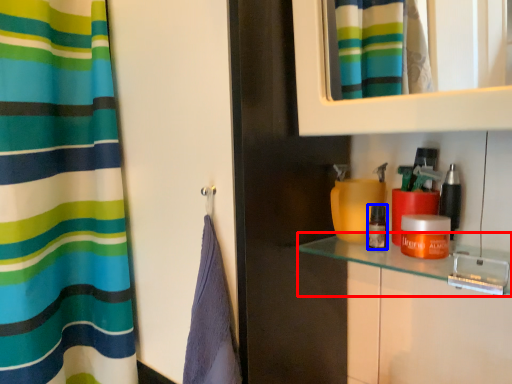
Question: Among these objects, which one is nearest to the camera, counter top (highlighted by a red box) or cosmetic (highlighted by a blue box)?

Choices:
 (A) counter top
 (B) cosmetic

Answer: (A)